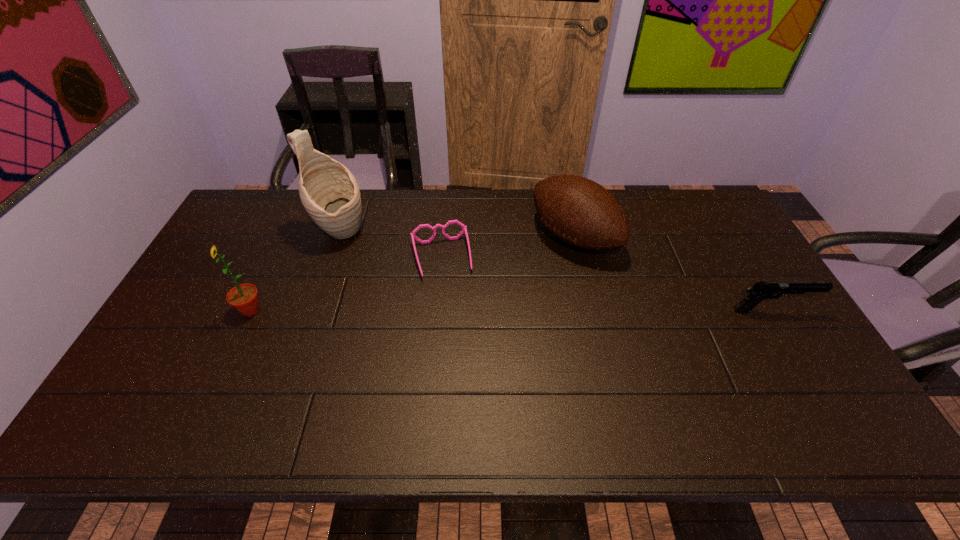
At what (x,y) coordinates should I click in order to perform the action: click on vacant space that's between the football and the fourth object from right to left. Please return your answer as a coordinate pair (x, y). The image size is (960, 540). Looking at the image, I should click on (457, 235).

Point out which object is positioned as the second nearest to the sunflower. Please provide its 2D coordinates. Your answer should be formatted as a tuple, i.e. [(x, y)], where the tuple contains the x and y coordinates of a point satisfying the conditions above.

[(464, 228)]

The height and width of the screenshot is (540, 960). What are the coordinates of `the fourth closest object to the rightmost object` in the screenshot? It's located at (244, 298).

The image size is (960, 540). Find the location of `vacant region that satisfies the following two spatial constraints: 1. on the front side of the rightmost object; 2. at the aiming end of the fourth object from left to right`. vacant region that satisfies the following two spatial constraints: 1. on the front side of the rightmost object; 2. at the aiming end of the fourth object from left to right is located at coordinates (590, 310).

Where is `vacant space that satisfies the following two spatial constraints: 1. on the front side of the gun; 2. at the aiming end of the third shortest object`? The image size is (960, 540). vacant space that satisfies the following two spatial constraints: 1. on the front side of the gun; 2. at the aiming end of the third shortest object is located at coordinates (590, 310).